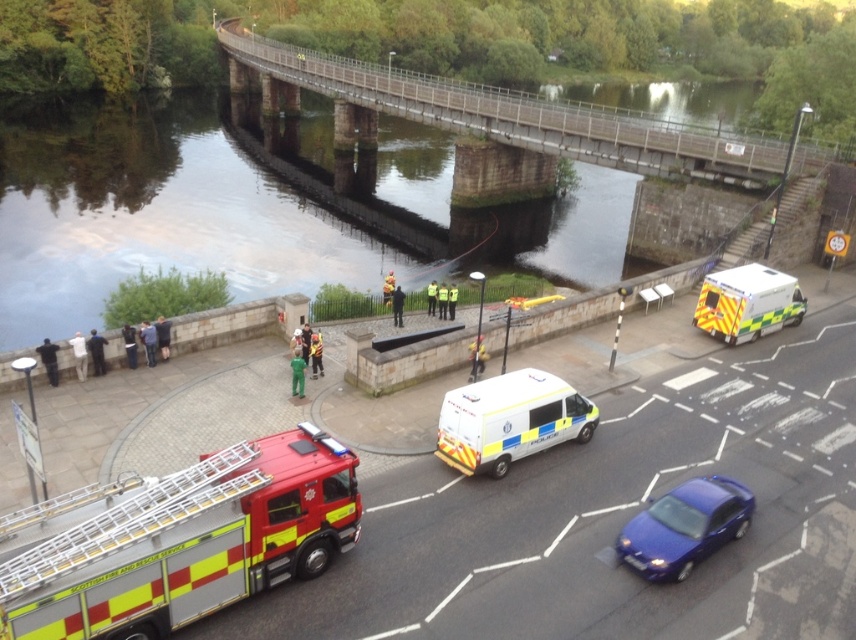
Question: Can you confirm if yellow and red reflective fire truck at lower left is thinner than yellow reflective van at center-right?

Choices:
 (A) no
 (B) yes

Answer: (A)

Question: Is greenish reflective water at center to the left of yellow reflective van at center-right from the viewer's perspective?

Choices:
 (A) no
 (B) yes

Answer: (B)

Question: Which of these objects is positioned farthest from the glossy blue sedan at lower right?

Choices:
 (A) yellow reflective van at center-right
 (B) white/police van at center
 (C) yellow and red reflective fire truck at lower left
 (D) concrete bridge at upper center

Answer: (D)

Question: Which point is closer to the camera?

Choices:
 (A) glossy blue sedan at lower right
 (B) concrete bridge at upper center

Answer: (A)

Question: Which of these objects is positioned farthest from the white/police van at center?

Choices:
 (A) yellow and red reflective fire truck at lower left
 (B) yellow reflective van at center-right
 (C) glossy blue sedan at lower right

Answer: (B)

Question: Does greenish reflective water at center have a lesser width compared to yellow reflective van at center-right?

Choices:
 (A) no
 (B) yes

Answer: (A)